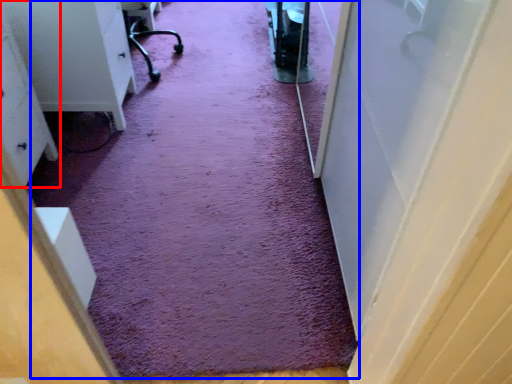
Question: Which point is further to the camera, furniture (highlighted by a red box) or doormat (highlighted by a blue box)?

Choices:
 (A) furniture
 (B) doormat

Answer: (B)